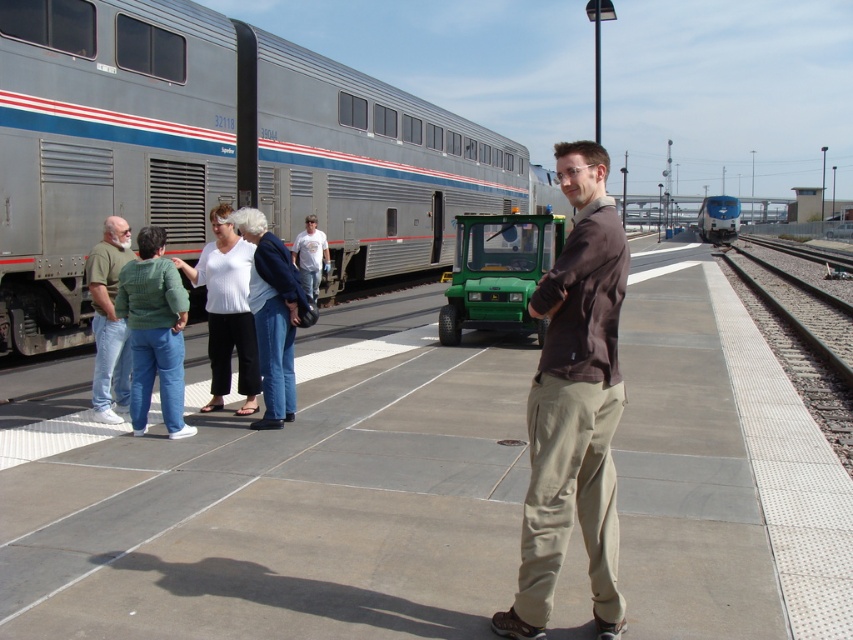
Looking at this image, which is more to the left, white shirt at center or denim jacket at center?

white shirt at center

Is white shirt at center further to the viewer compared to denim jacket at center?

That is True.

Where is `white shirt at center`? This screenshot has height=640, width=853. white shirt at center is located at coordinates (227, 310).

Which of these two, silver metallic train at left or green cotton shirt at left, stands shorter?

With less height is green cotton shirt at left.

Does silver metallic train at left have a greater height compared to green cotton shirt at left?

Yes.

I want to click on silver metallic train at left, so click(x=212, y=150).

This screenshot has width=853, height=640. What are the coordinates of `matte green jacket at left` in the screenshot? It's located at (154, 332).

Which is behind, point (181, 300) or point (97, 314)?

The point (97, 314) is behind.

Who is more distant from viewer, (173, 339) or (93, 326)?

Point (93, 326)

The width and height of the screenshot is (853, 640). What are the coordinates of `matte green jacket at left` in the screenshot? It's located at (154, 332).